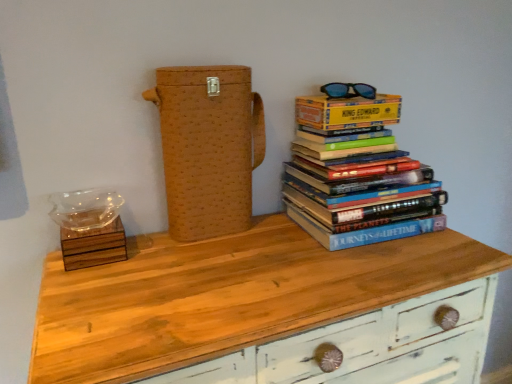
This screenshot has height=384, width=512. Find the location of `free area in between hardcover books at upper right and brown woven box at center`. free area in between hardcover books at upper right and brown woven box at center is located at coordinates (258, 235).